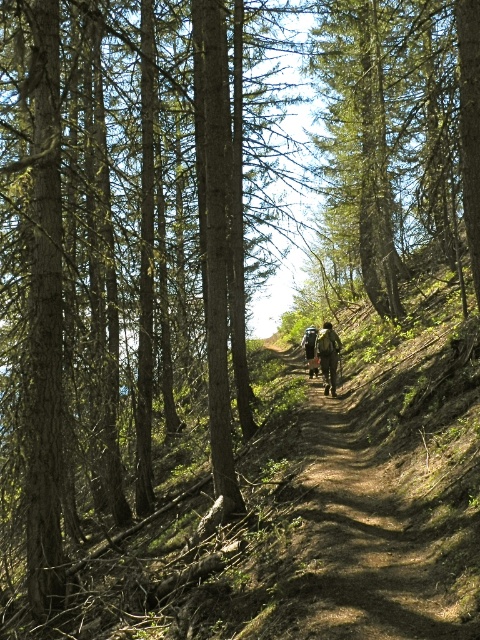
Question: Can you confirm if camouflage fabric backpacks at center is positioned to the left of camouflage fabric backpack at center?

Choices:
 (A) no
 (B) yes

Answer: (A)

Question: Estimate the real-world distances between objects in this image. Which object is farther from the camouflage fabric backpacks at center?

Choices:
 (A) camouflage fabric backpack at center
 (B) brown dirt path at center

Answer: (B)

Question: Does camouflage fabric backpacks at center have a greater width compared to camouflage fabric backpack at center?

Choices:
 (A) yes
 (B) no

Answer: (A)

Question: Is brown dirt path at center to the left of camouflage fabric backpack at center from the viewer's perspective?

Choices:
 (A) no
 (B) yes

Answer: (B)

Question: Estimate the real-world distances between objects in this image. Which object is farther from the camouflage fabric backpack at center?

Choices:
 (A) camouflage fabric backpacks at center
 (B) brown dirt path at center

Answer: (B)

Question: Among these points, which one is nearest to the camera?

Choices:
 (A) (357, 426)
 (B) (312, 330)

Answer: (A)